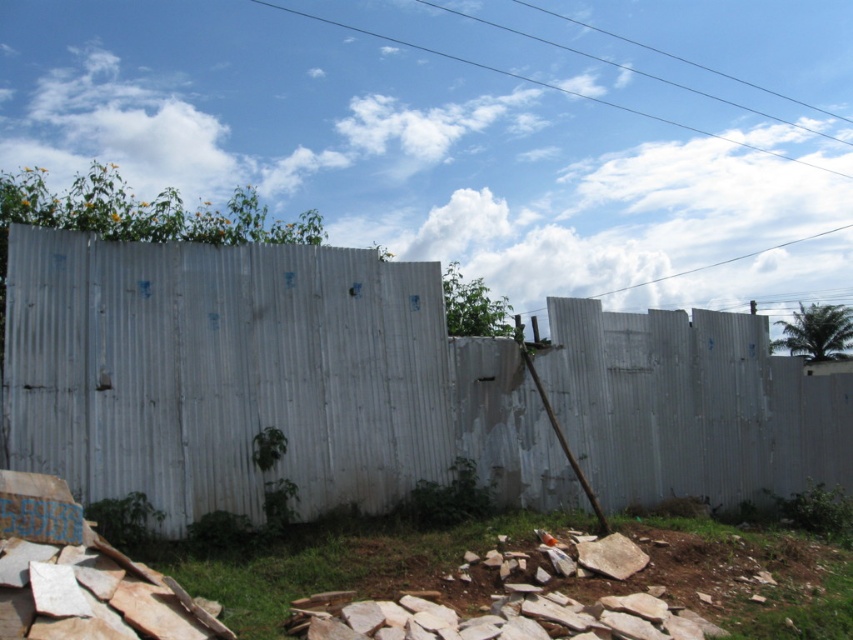
You are standing in front of the scene described. You need to locate the white corrugated metal fence at center. Where is it positioned in terms of coordinates?

The white corrugated metal fence at center is positioned at coordinates point (257, 378).

You are standing in front of the white corrugated metal fence at center and want to find the gray rough stone at lower center. Which direction should you look to find it?

The gray rough stone at lower center is to the left of the white corrugated metal fence at center, so you should look to the left.

You are standing in front of the white corrugated metal fence at center and the gray rough stone at lower center. Which object is taller?

The white corrugated metal fence at center is much taller than the gray rough stone at lower center.